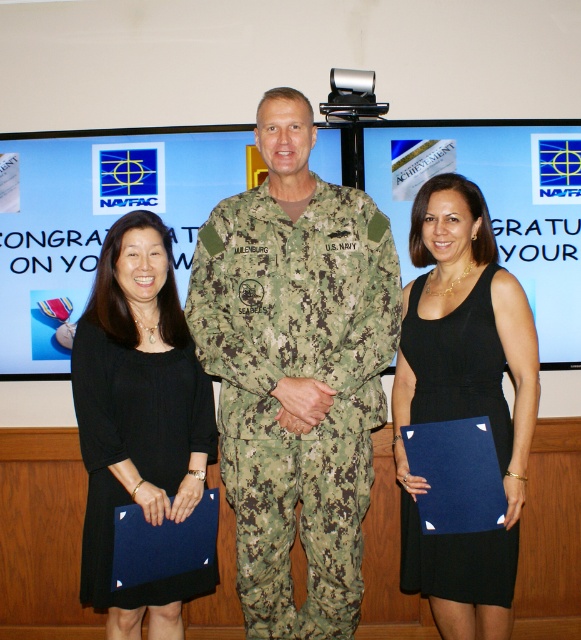
Question: Which point is closer to the camera taking this photo?

Choices:
 (A) (184, 460)
 (B) (389, 243)
 (C) (410, 380)

Answer: (B)

Question: Can you confirm if black dress at center is smaller than black matte dress at left?

Choices:
 (A) yes
 (B) no

Answer: (B)

Question: Does camouflage uniform at center lie behind black dress at center?

Choices:
 (A) no
 (B) yes

Answer: (A)

Question: Can you confirm if camouflage uniform at center is positioned above black dress at center?

Choices:
 (A) yes
 (B) no

Answer: (A)

Question: Estimate the real-world distances between objects in this image. Which object is closer to the black matte dress at left?

Choices:
 (A) black dress at center
 (B) camouflage uniform at center

Answer: (B)

Question: Based on their relative distances, which object is nearer to the black dress at center?

Choices:
 (A) camouflage uniform at center
 (B) black matte dress at left

Answer: (A)